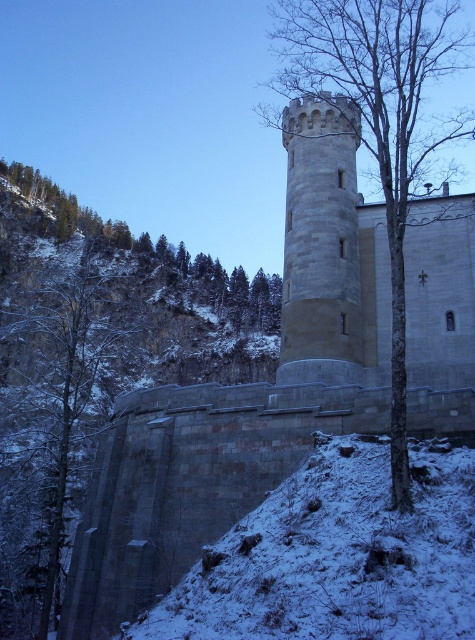
You are an artist sketching this scene and want to draw the snowy bark tree at left and the bare wood tree at center. Which tree should you draw first if you are moving from left to right across your paper?

You should draw the snowy bark tree at left first because it is positioned to the left of the bare wood tree at center.